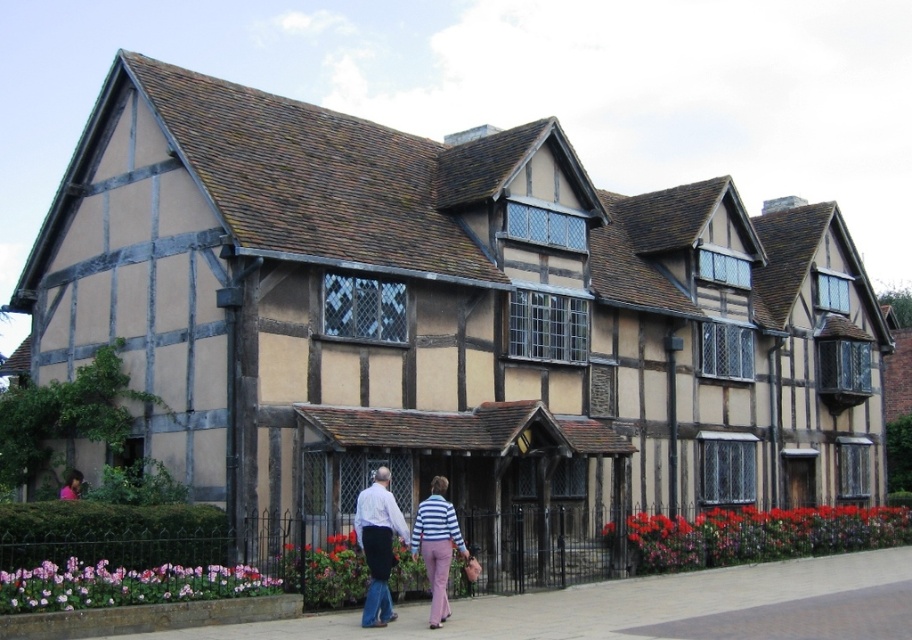
Question: Considering the real-world distances, which object is farthest from the light blue shirt at center?

Choices:
 (A) striped cotton sweater at center
 (B) striped fabric pants at center

Answer: (B)

Question: In this image, where is striped cotton sweater at center located relative to striped fabric pants at center?

Choices:
 (A) above
 (B) below

Answer: (B)

Question: Which point is closer to the camera taking this photo?

Choices:
 (A) (368, 586)
 (B) (416, 512)

Answer: (A)

Question: Is light blue shirt at center positioned behind striped fabric pants at center?

Choices:
 (A) no
 (B) yes

Answer: (A)

Question: Based on their relative distances, which object is nearer to the striped fabric pants at center?

Choices:
 (A) light blue shirt at center
 (B) striped cotton sweater at center

Answer: (B)

Question: Does striped cotton sweater at center appear over striped fabric pants at center?

Choices:
 (A) no
 (B) yes

Answer: (A)